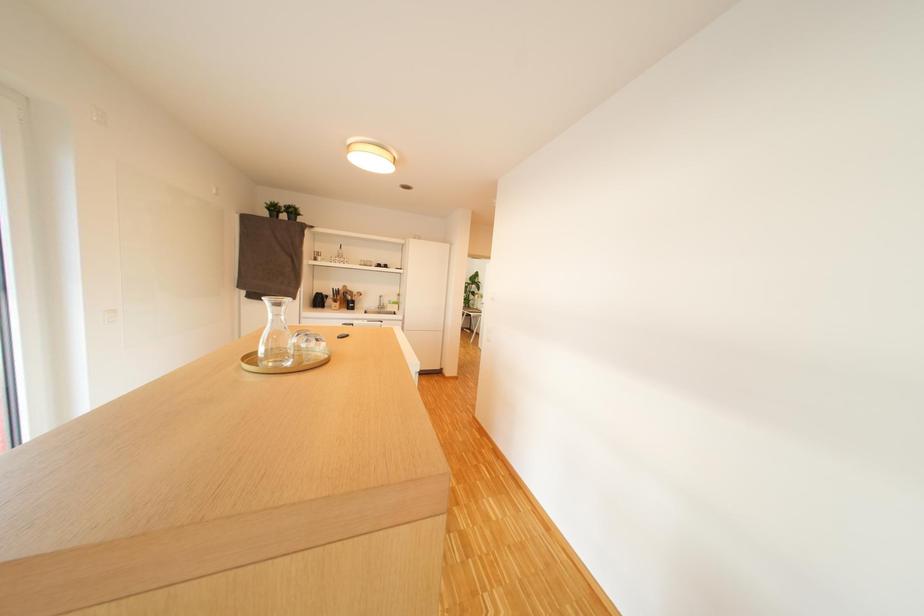
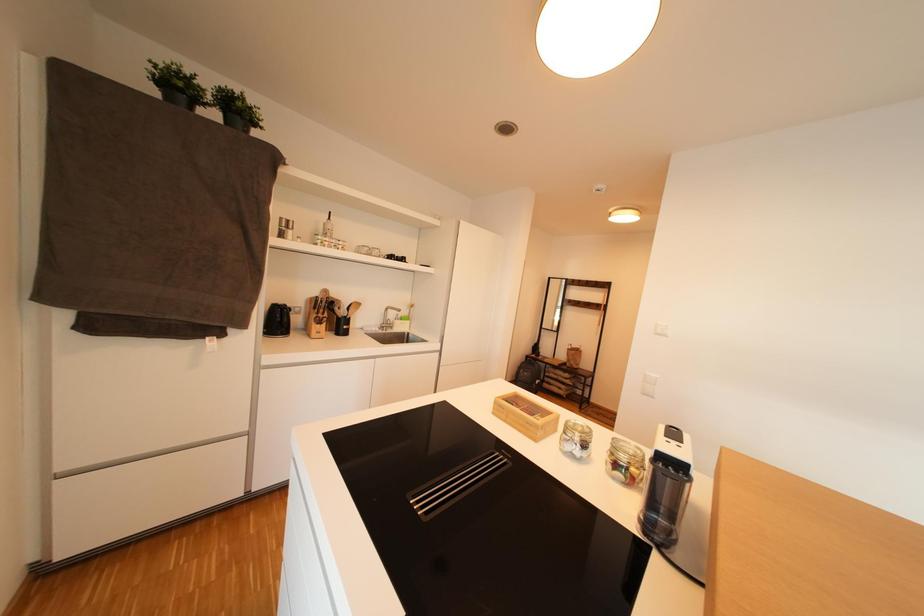
Which direction would the cameraman need to move to produce the second image?

The cameraman moved toward left, forward.